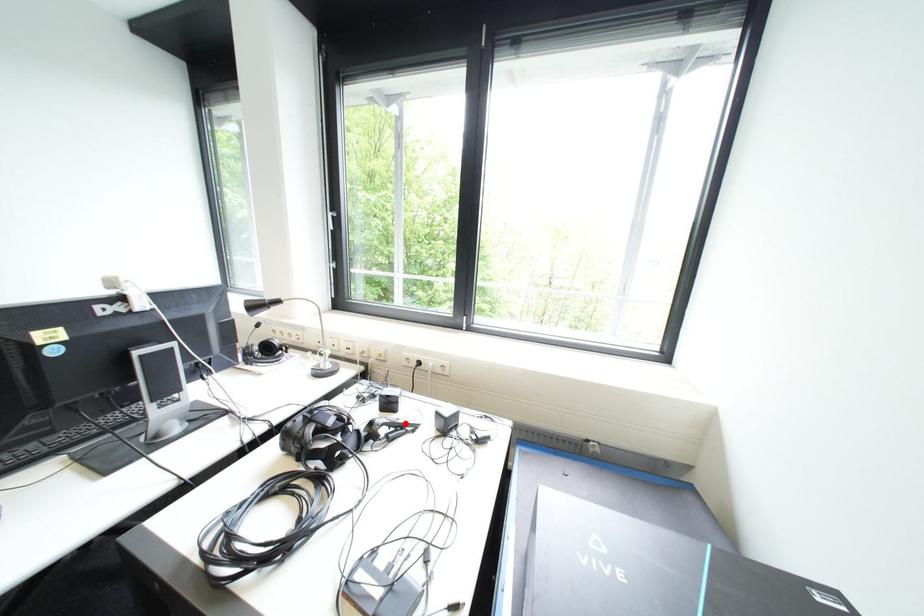
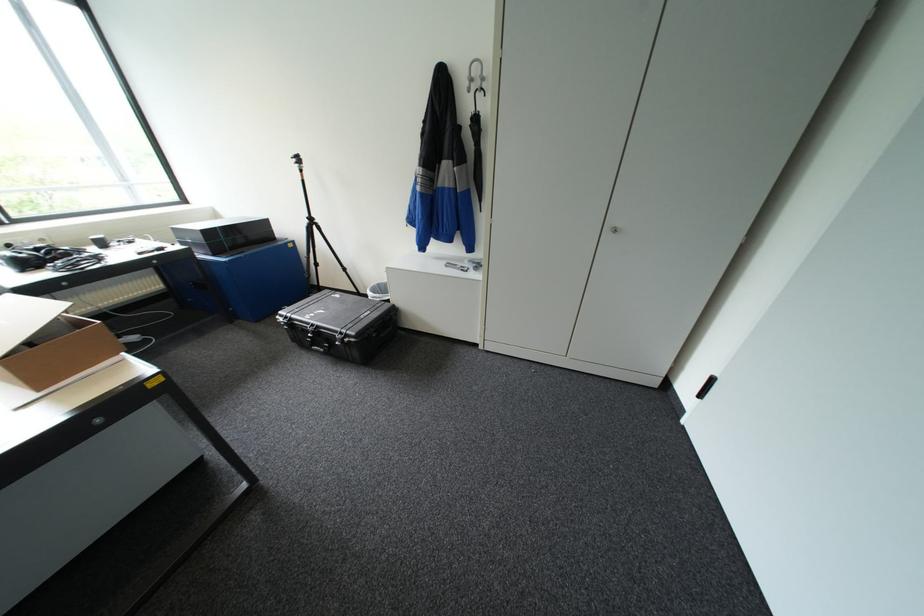
Question: I am providing you with two images of the same scene from different viewpoints. A red point is marked on the first image. Can you still see the location of the red point in image 2?

Choices:
 (A) Yes
 (B) No

Answer: (B)